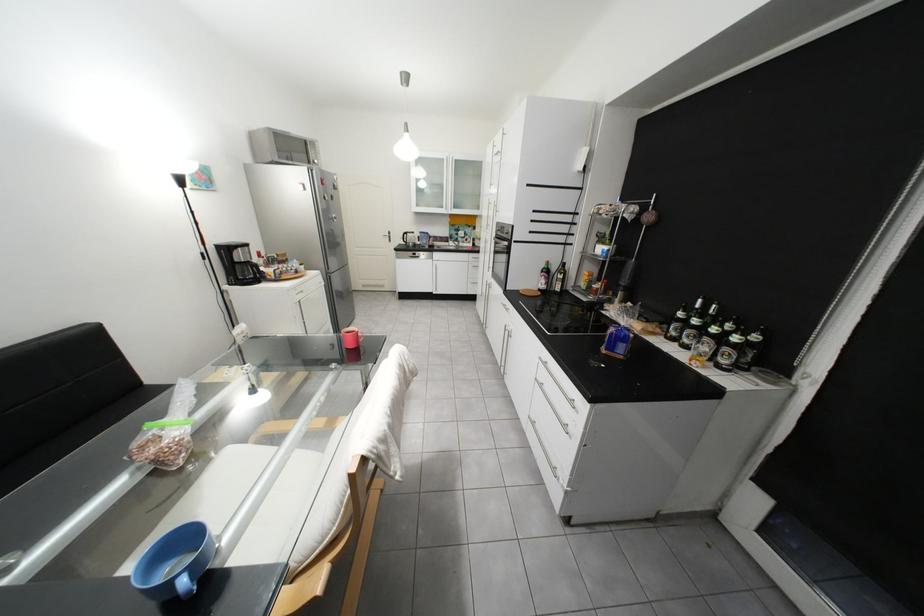
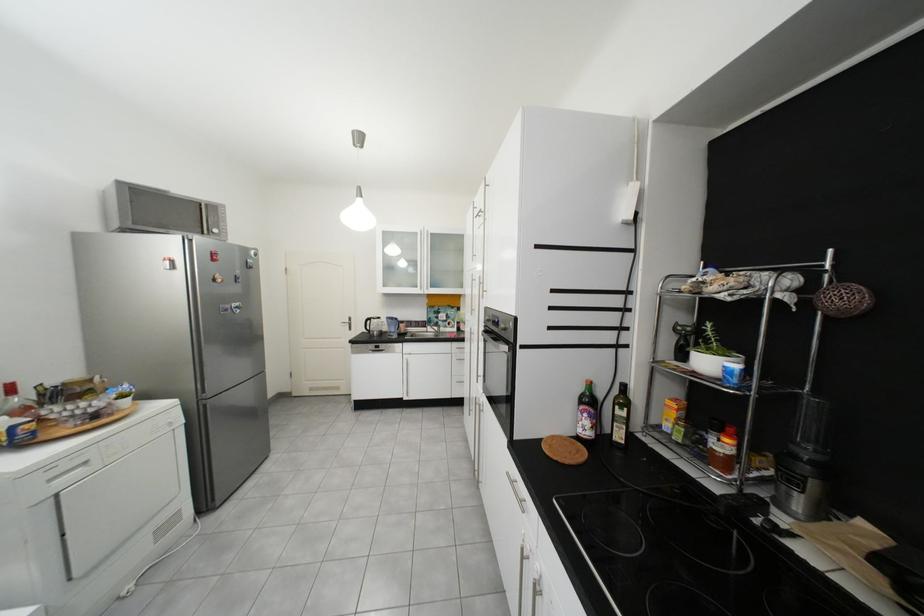
In the second image, find the point that corresponds to (553,273) in the first image.

(592, 403)